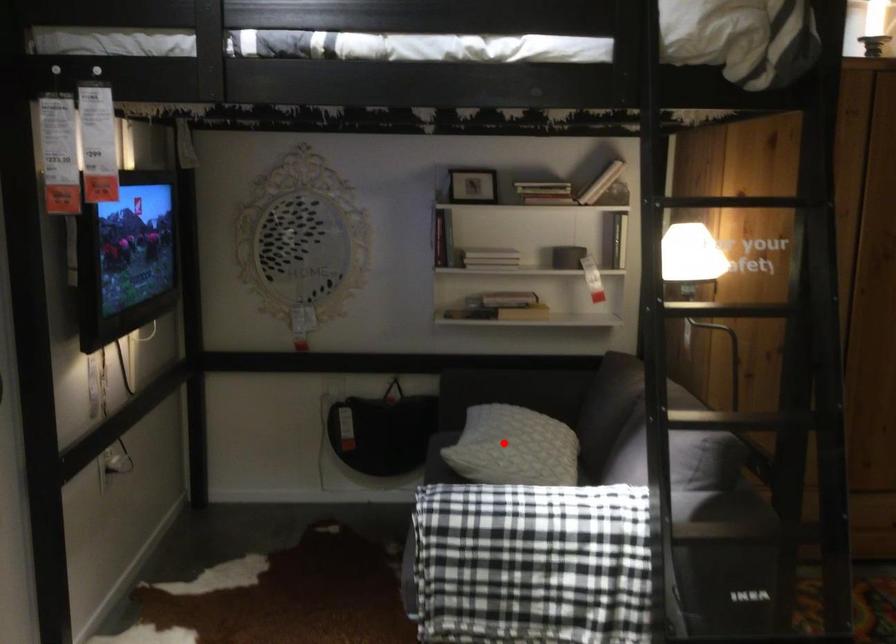
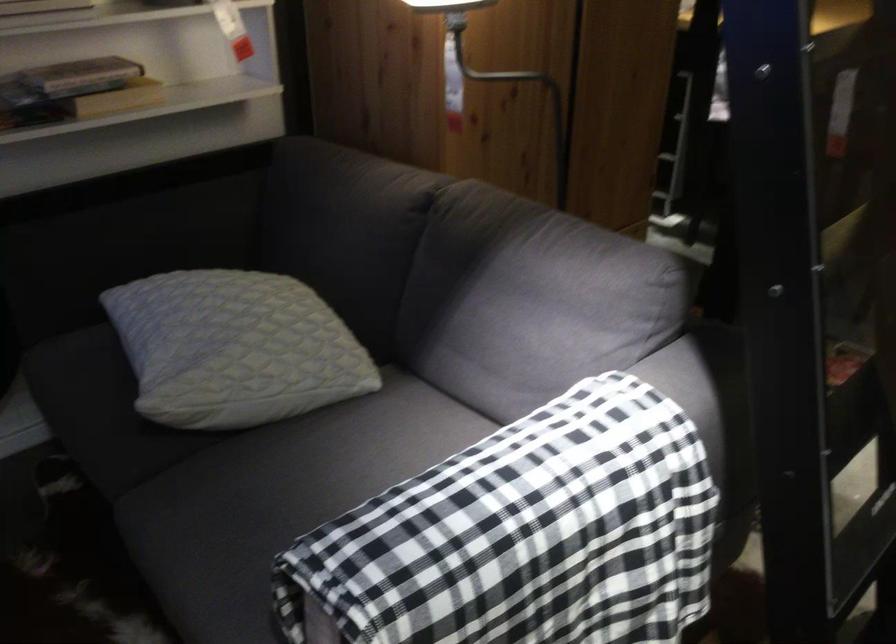
In the second image, find the point that corresponds to the highlighted location in the first image.

(234, 348)